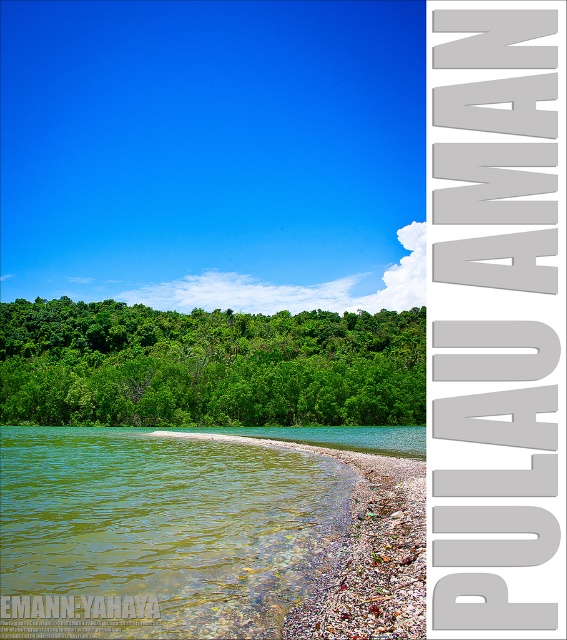
Can you confirm if green translucent water at lower left is positioned to the right of green leafy trees at center?

Correct, you'll find green translucent water at lower left to the right of green leafy trees at center.

Who is lower down, green translucent water at lower left or green leafy trees at center?

Positioned lower is green translucent water at lower left.

At what (x,y) coordinates should I click in order to perform the action: click on green translucent water at lower left. Please return your answer as a coordinate pair (x, y). This screenshot has height=640, width=567. Looking at the image, I should click on coord(156,532).